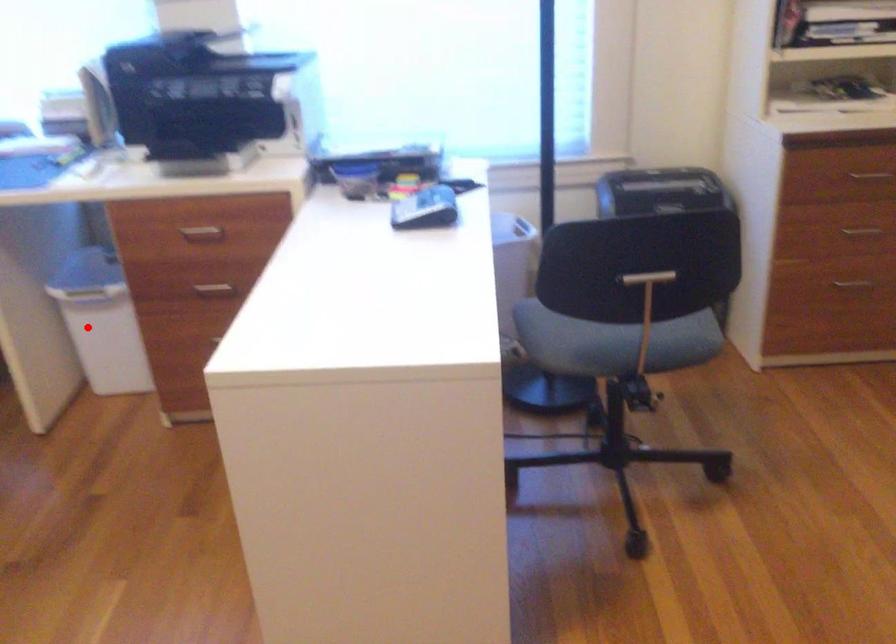
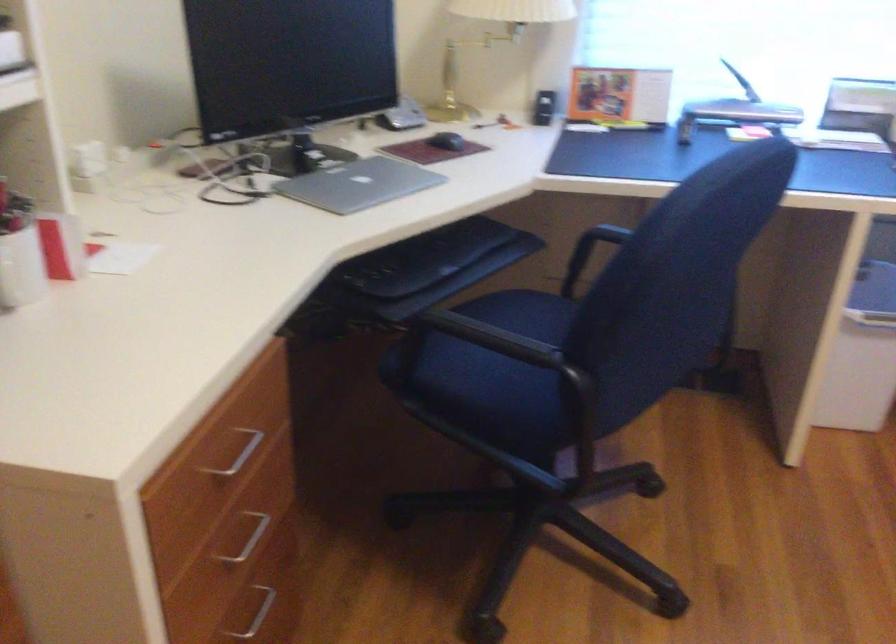
In the second image, find the point that corresponds to the highlighted location in the first image.

(862, 355)